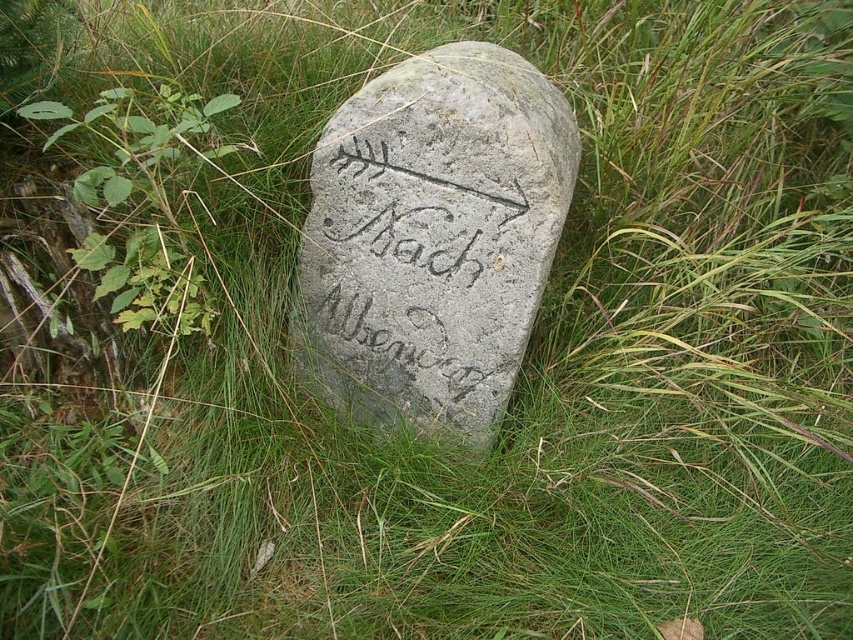
Based on the photo, is gray stone marker at center bigger than green leafy plant at left?

Indeed, gray stone marker at center has a larger size compared to green leafy plant at left.

Does gray stone marker at center have a greater height compared to green leafy plant at left?

Yes, gray stone marker at center is taller than green leafy plant at left.

Is point (360, 269) positioned behind point (131, 192)?

Yes, point (360, 269) is behind point (131, 192).

At what (x,y) coordinates should I click in order to perform the action: click on gray stone marker at center. Please return your answer as a coordinate pair (x, y). The width and height of the screenshot is (853, 640). Looking at the image, I should click on (432, 237).